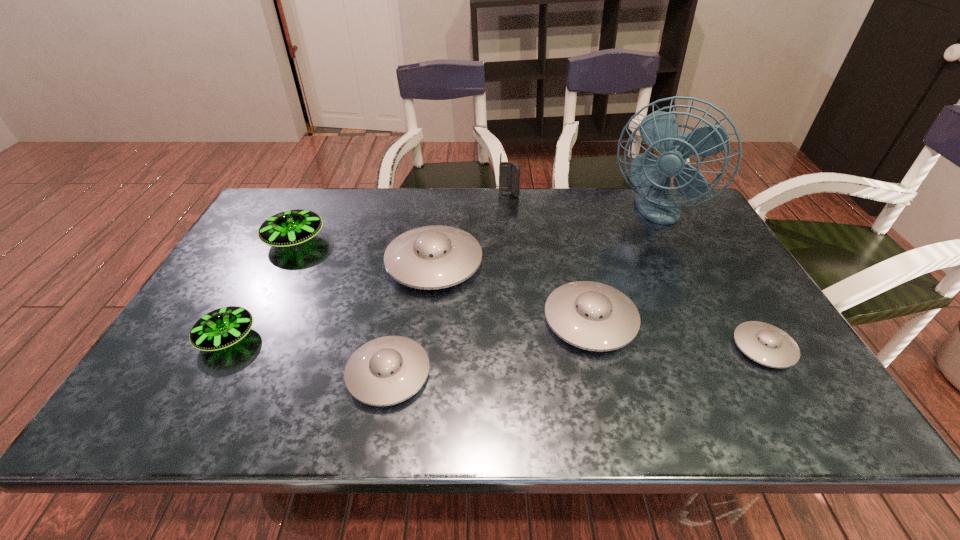
You are a GUI agent. You are given a task and a screenshot of the screen. Output one action in this format:
    pyautogui.click(x=<x>, y=<y>)
    Task: Click on the cellular telephone that is at the far edge
    
    Given the screenshot: What is the action you would take?
    pyautogui.click(x=509, y=173)

Find the location of a particular element. The height and width of the screenshot is (540, 960). saucer at the far edge is located at coordinates (289, 228).

Find the location of a particular element. object located at the near edge is located at coordinates (388, 370).

At what (x,y) coordinates should I click in order to perform the action: click on fan present at the right edge. Please return your answer as a coordinate pair (x, y). This screenshot has width=960, height=540. Looking at the image, I should click on (659, 130).

I want to click on saucer situated at the right edge, so click(768, 345).

This screenshot has width=960, height=540. Find the location of `object that is at the far left corner`. object that is at the far left corner is located at coordinates (289, 228).

This screenshot has height=540, width=960. What are the coordinates of `object positioned at the far right corner` in the screenshot? It's located at (659, 130).

In the image, there is a desktop. Where is `vacant space at the far edge`? The width and height of the screenshot is (960, 540). vacant space at the far edge is located at coordinates (468, 219).

Locate an element on the screen. free space at the near edge of the desktop is located at coordinates (722, 428).

Image resolution: width=960 pixels, height=540 pixels. Identify the location of free region at the left edge. [180, 340].